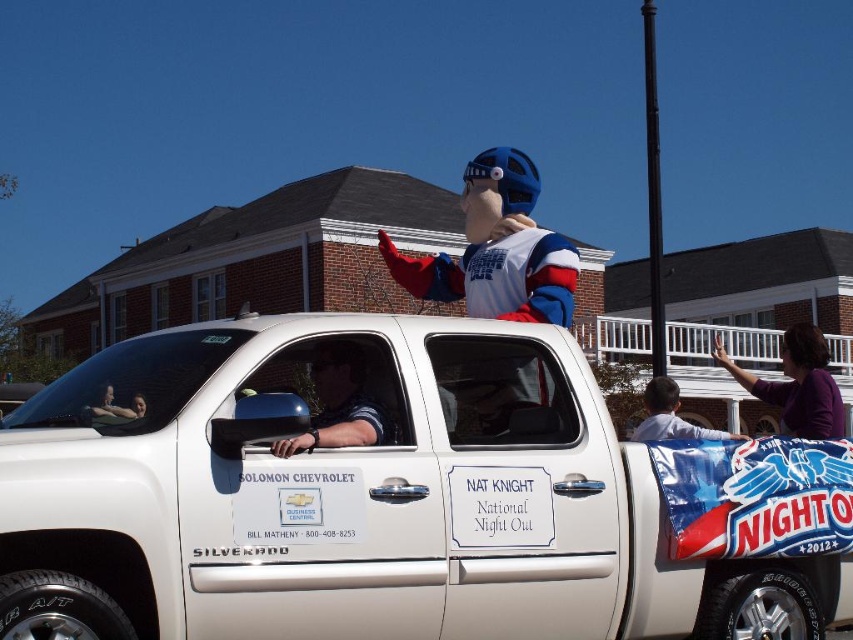
Question: Considering the real-world distances, which object is farthest from the purple fabric at upper right?

Choices:
 (A) white matte truck at center
 (B) polished dark blue shirt at center
 (C) light blue shirt at center

Answer: (B)

Question: Does white matte truck at center appear over purple fabric at upper right?

Choices:
 (A) no
 (B) yes

Answer: (B)

Question: Which point appears farthest from the camera in this image?

Choices:
 (A) (256, 536)
 (B) (346, 404)
 (C) (675, 426)
 (D) (799, 378)

Answer: (D)

Question: Does purple fabric at upper right have a smaller size compared to light blue shirt at center?

Choices:
 (A) no
 (B) yes

Answer: (A)

Question: Which object is farther from the camera taking this photo?

Choices:
 (A) white matte truck at center
 (B) light blue shirt at center
 (C) polished dark blue shirt at center
 (D) purple fabric at upper right

Answer: (D)

Question: Is polished dark blue shirt at center above light blue shirt at center?

Choices:
 (A) no
 (B) yes

Answer: (B)